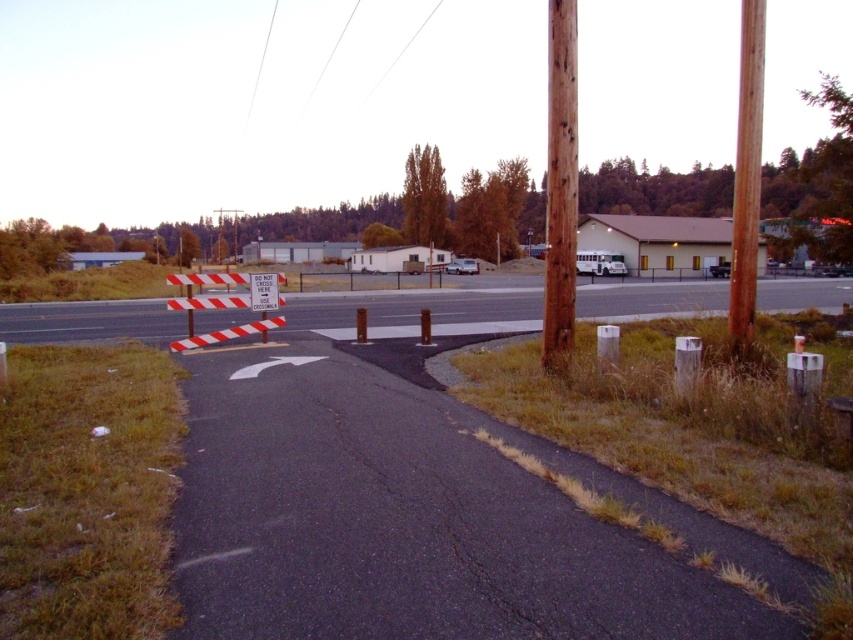
You are a pedestrian trying to cross the road safely. You see the white striped barrier at center and the brown rough wood pole at upper right. How far apart are these two objects from each other?

The white striped barrier at center and the brown rough wood pole at upper right are 15.57 meters apart.

You are standing at the starting point of the road in the image. There is a brown wooden pole at right marked by point (746, 177). If you walk straight ahead along the road, will you pass the brown wooden pole at right before reaching the barricade with the sign?

The point (746, 177) marks the brown wooden pole at right, which is located further along the road beyond the barricade with the sign. Therefore, if you walk straight ahead, you will reach the barricade first before passing the brown wooden pole at right.

You are driving a car and see the white striped barrier at center and the brown rough wood pole at upper right in your view. Which object is closer to the bottom of your windshield?

The white striped barrier at center is located below the brown rough wood pole at upper right, so it is closer to the bottom of your windshield.